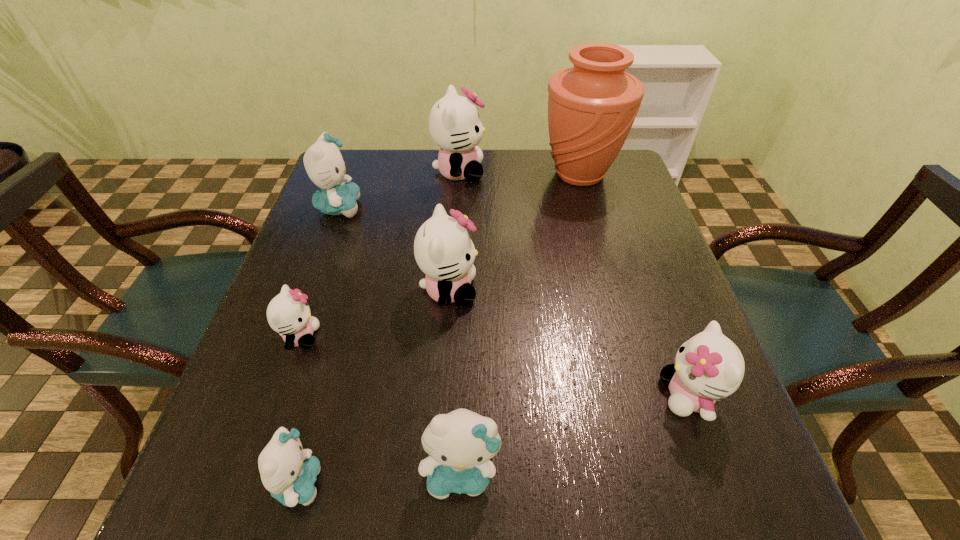
Find the location of a particular element. The image size is (960, 540). the tallest object is located at coordinates (592, 106).

You are a GUI agent. You are given a task and a screenshot of the screen. Output one action in this format:
    pyautogui.click(x=<x>, y=<y>)
    Task: Click on the terracotta vase
    This screenshot has width=960, height=540.
    Given the screenshot: What is the action you would take?
    pyautogui.click(x=592, y=106)

At what (x,y) coordinates should I click in order to perform the action: click on the tallest kitten. Please return your answer as a coordinate pair (x, y). The width and height of the screenshot is (960, 540). Looking at the image, I should click on (454, 124).

At what (x,y) coordinates should I click in order to perform the action: click on the biggest white kitten. Please return your answer as a coordinate pair (x, y). Looking at the image, I should click on (454, 124).

I want to click on the biggest blue kitten, so click(324, 164).

Where is `the second biggest white kitten`? The width and height of the screenshot is (960, 540). the second biggest white kitten is located at coordinates (443, 249).

I want to click on the second smallest white kitten, so click(708, 366).

Image resolution: width=960 pixels, height=540 pixels. Identify the location of the rightmost white kitten. (708, 366).

In order to click on the second biggest blue kitten in this screenshot , I will do [460, 444].

Identify the location of the leftmost white kitten. (288, 313).